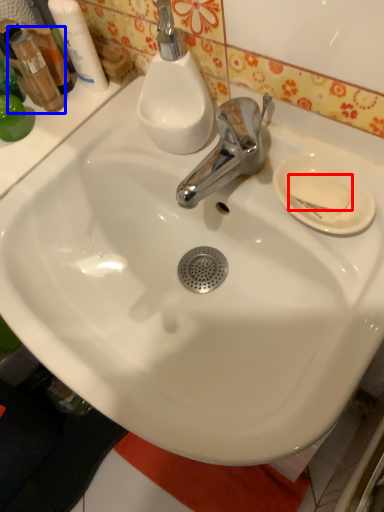
Question: Which object is closer to the camera taking this photo, soap (highlighted by a red box) or mouthwash (highlighted by a blue box)?

Choices:
 (A) soap
 (B) mouthwash

Answer: (A)